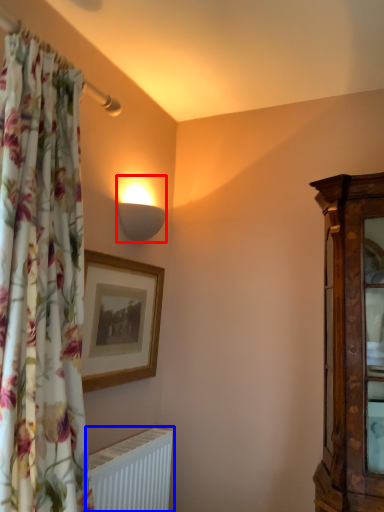
Question: Which object is closer to the camera taking this photo, lamp (highlighted by a red box) or radiator (highlighted by a blue box)?

Choices:
 (A) lamp
 (B) radiator

Answer: (B)